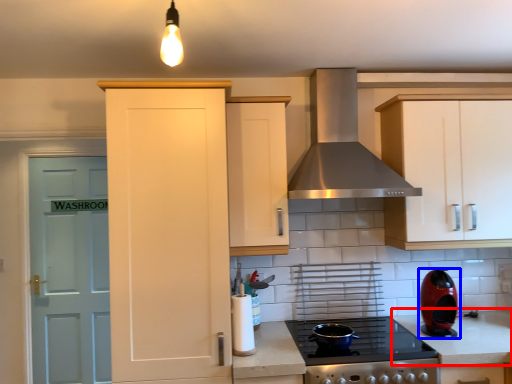
Question: Which object is closer to the camera taking this photo, counter top (highlighted by a red box) or kitchen appliance (highlighted by a blue box)?

Choices:
 (A) counter top
 (B) kitchen appliance

Answer: (A)